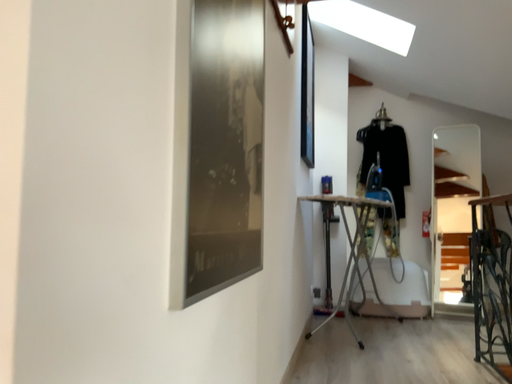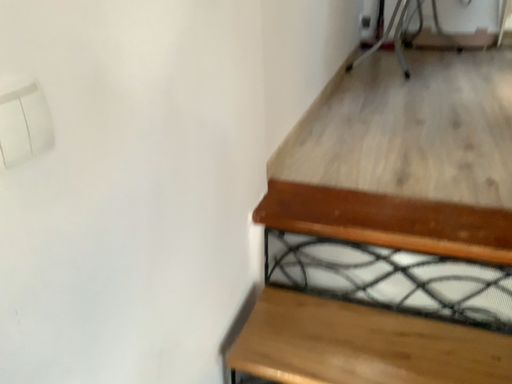
Question: How did the camera likely rotate when shooting the video?

Choices:
 (A) rotated upward
 (B) rotated downward

Answer: (B)